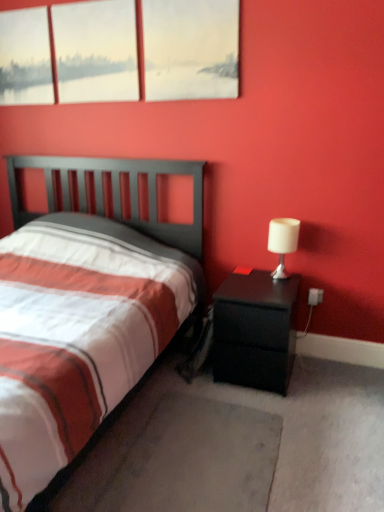
Where is `vacant space to the right of black matte nightstand at right`? vacant space to the right of black matte nightstand at right is located at coordinates (329, 380).